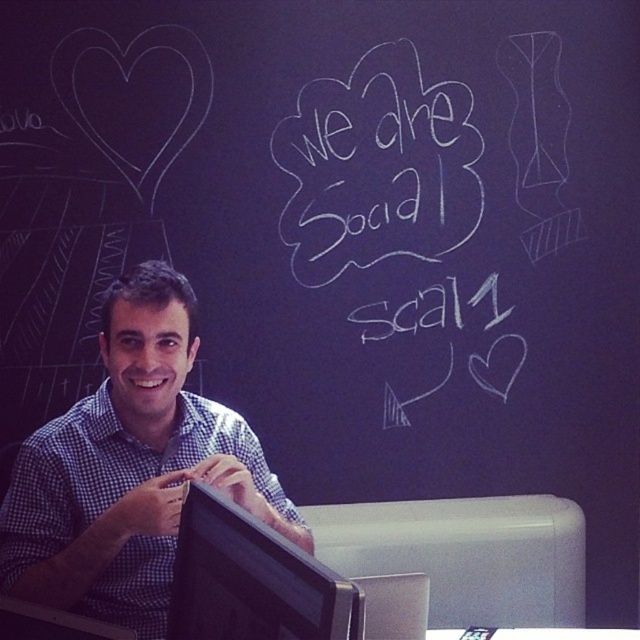
Between checkered fabric shirt at left and white chalk writing at upper center, which one appears on the left side from the viewer's perspective?

checkered fabric shirt at left is more to the left.

Is checkered fabric shirt at left to the right of white chalk writing at upper center from the viewer's perspective?

In fact, checkered fabric shirt at left is to the left of white chalk writing at upper center.

Does point (140, 317) lie behind point (465, 362)?

No, (140, 317) is in front of (465, 362).

Identify the location of checkered fabric shirt at left. This screenshot has width=640, height=640. (129, 467).

In the scene shown: Is white chalk writing at upper center thinner than black glossy monitor at center?

No, white chalk writing at upper center is not thinner than black glossy monitor at center.

Does white chalk writing at upper center appear over black glossy monitor at center?

Yes.

Does point (332, 205) come closer to viewer compared to point (333, 624)?

That is False.

Where is `white chalk writing at upper center`? This screenshot has width=640, height=640. white chalk writing at upper center is located at coordinates (385, 196).

You are a GUI agent. You are given a task and a screenshot of the screen. Output one action in this format:
    pyautogui.click(x=<x>, y=<y>)
    Task: Click on the checkered fabric shirt at left
    This screenshot has height=640, width=640.
    Given the screenshot: What is the action you would take?
    pyautogui.click(x=129, y=467)

Is point (204, 451) farther from viewer compared to point (204, 525)?

Yes, point (204, 451) is behind point (204, 525).

The width and height of the screenshot is (640, 640). What do you see at coordinates (129, 467) in the screenshot?
I see `checkered fabric shirt at left` at bounding box center [129, 467].

What are the coordinates of `checkered fabric shirt at left` in the screenshot? It's located at (129, 467).